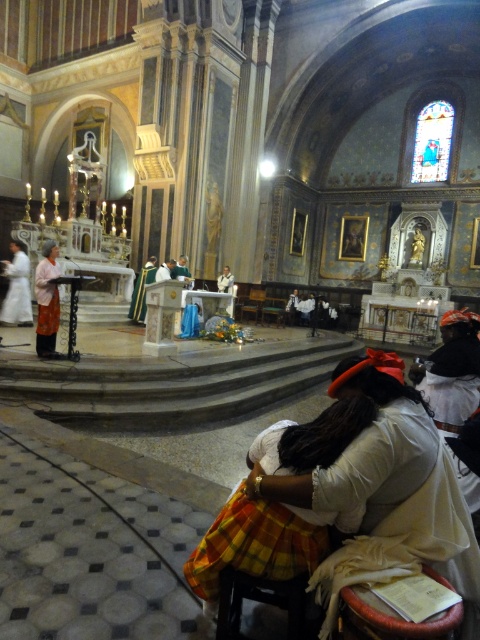
Is white matte robe at left taller than green velvet robe at center?

Correct, white matte robe at left is much taller as green velvet robe at center.

Who is more distant from viewer, (13, 292) or (136, 278)?

The point (136, 278) is behind.

Between point (20, 310) and point (147, 260), which one is positioned behind?

Positioned behind is point (147, 260).

Where is `white matte robe at left`? The width and height of the screenshot is (480, 640). white matte robe at left is located at coordinates (16, 291).

Looking at this image, who is shorter, white cotton dress at lower right or green velvet robe at center?

white cotton dress at lower right is shorter.

Which is above, white cotton dress at lower right or green velvet robe at center?

green velvet robe at center is above.

Which is in front, point (398, 376) or point (143, 289)?

Point (398, 376) is in front.

Locate an element on the screen. The image size is (480, 640). white cotton dress at lower right is located at coordinates (384, 490).

Does matte brown robe at left appear over wooden chair at center?

Incorrect, matte brown robe at left is not positioned above wooden chair at center.

How distant is matte brown robe at left from wooden chair at center?

matte brown robe at left is 13.14 meters away from wooden chair at center.

Which is behind, point (40, 323) or point (249, 296)?

The point (249, 296) is behind.

The width and height of the screenshot is (480, 640). I want to click on matte brown robe at left, so click(x=47, y=301).